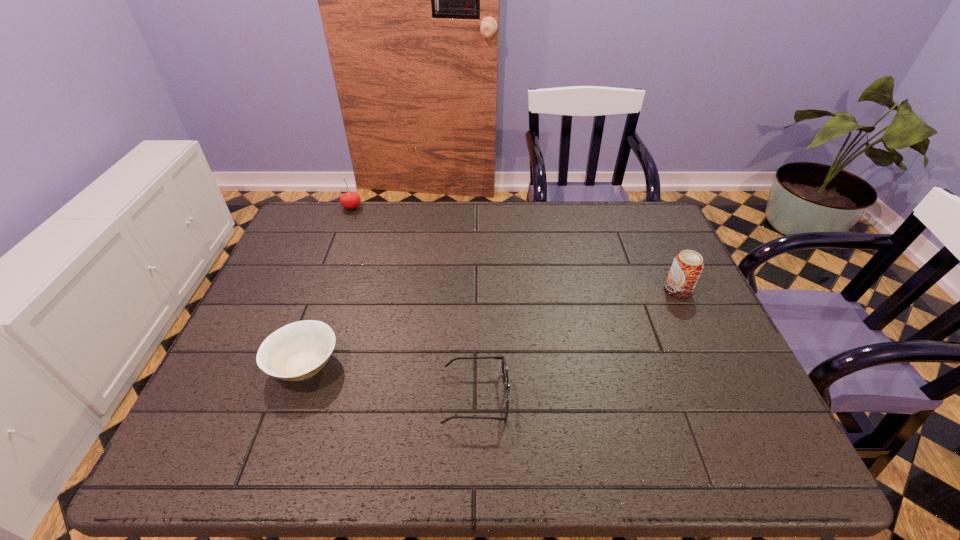
The height and width of the screenshot is (540, 960). Identify the location of blank region between the farthest object and the third tallest object. [x=328, y=286].

Choose which object is the third nearest neighbor to the bowl. Please provide its 2D coordinates. Your answer should be formatted as a tuple, i.e. [(x, y)], where the tuple contains the x and y coordinates of a point satisfying the conditions above.

[(687, 266)]

Where is `object that is the closest to the rightmost object`? object that is the closest to the rightmost object is located at coordinates (504, 366).

Identify the location of vacant region that satisfies the following two spatial constraints: 1. on the front side of the rightmost object; 2. on the left side of the cherry. The image size is (960, 540). (321, 290).